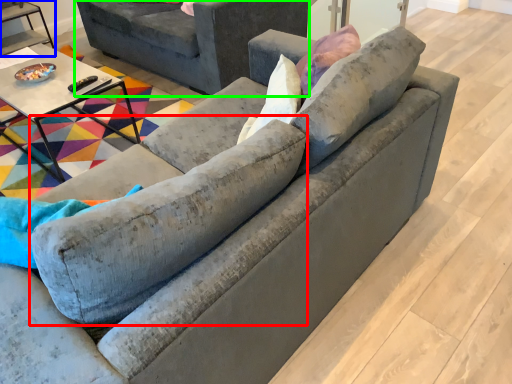
Question: Which object is positioned closest to swivel chair (highlighted by a red box)? Select from table (highlighted by a blue box) and studio couch (highlighted by a green box).

Choices:
 (A) table
 (B) studio couch

Answer: (B)